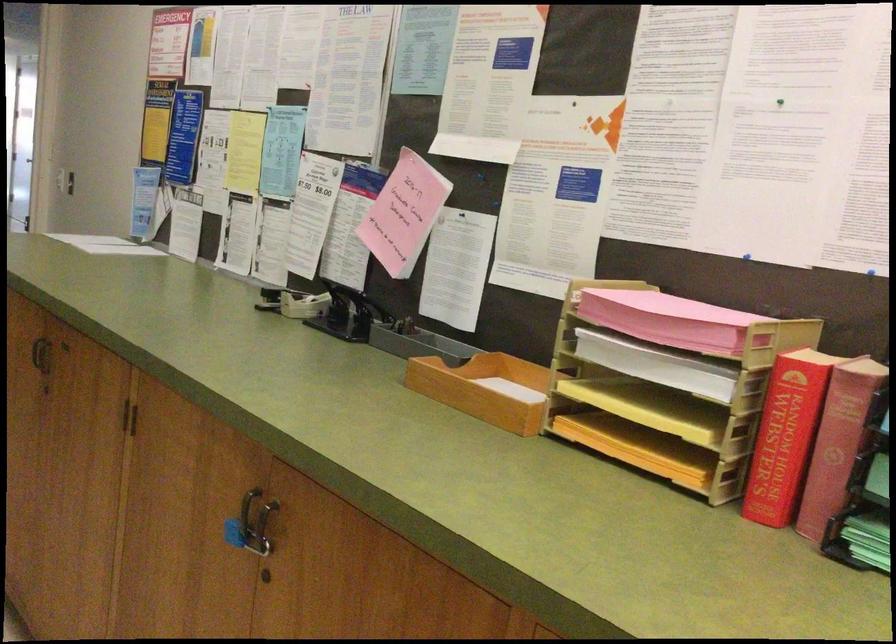
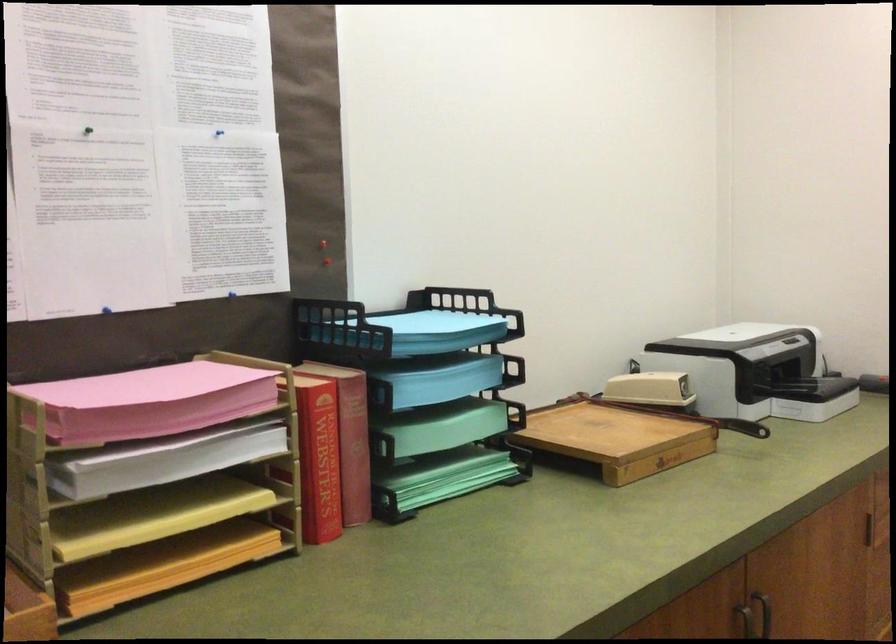
Where in the second image is the point corresponding to point 673,412 from the first image?

(151, 515)